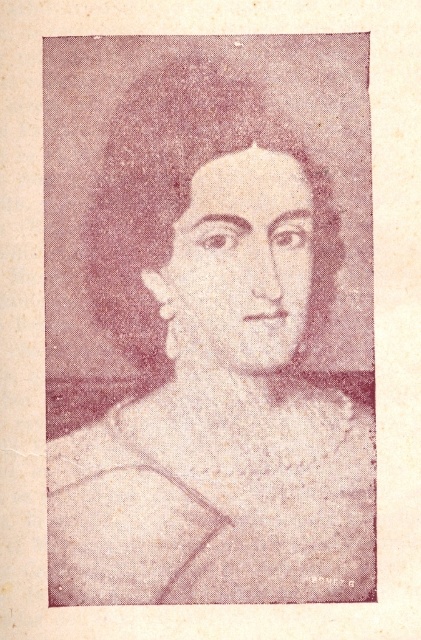
You are a costume designer preparing for a historical drama set in the 19th century. You have two fabric swatches to choose from for the dress of the main character. The gray textured fabric at center and the textured beige fabric at center. Which fabric swatch has a larger size?

The gray textured fabric at center is bigger than the textured beige fabric at center, so the gray textured fabric at center has a larger size.

You are an antique clothing expert examining this vintage photograph. You notice two fabrics in the center area. The first is a gray textured fabric at center, and the second is a textured beige fabric at center. Based on their positions in the image, which fabric is located higher up?

The gray textured fabric at center is above the textured beige fabric at center, so the gray textured fabric at center is higher up.